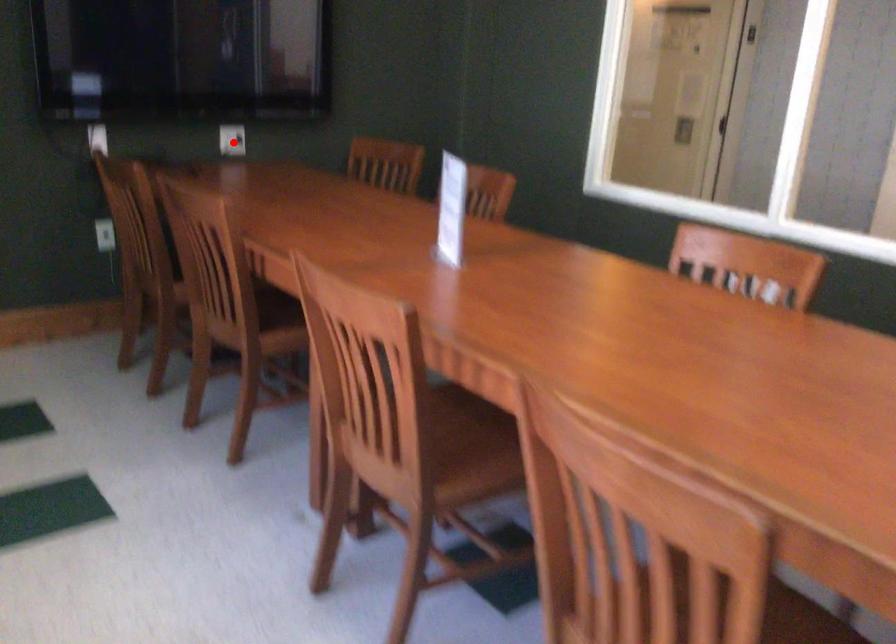
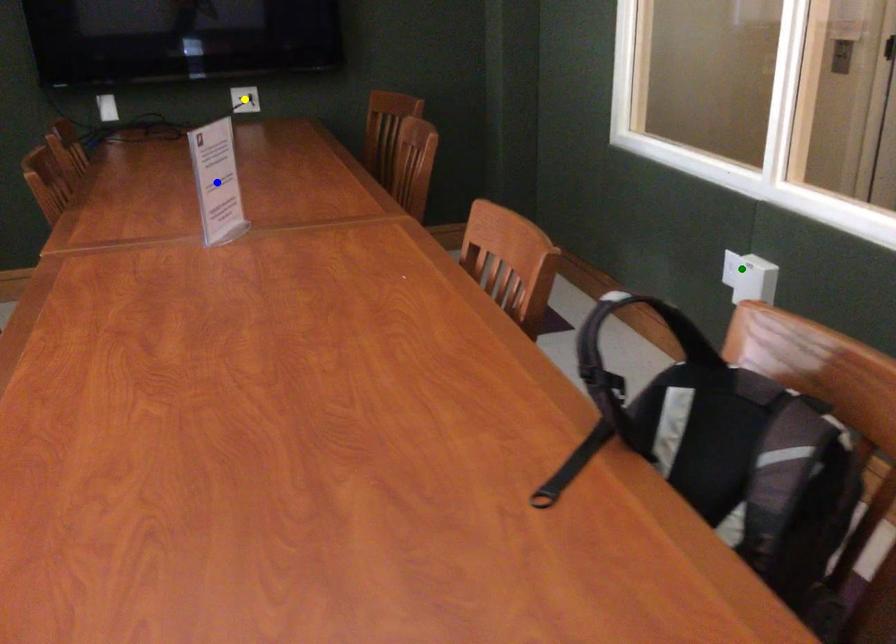
Question: I am providing you with two images of the same scene from different viewpoints. A red point is marked on the first image. You are given multiple points on the second image. Which mark in image 2 goes with the point in image 1?

Choices:
 (A) yellow point
 (B) green point
 (C) blue point

Answer: (A)